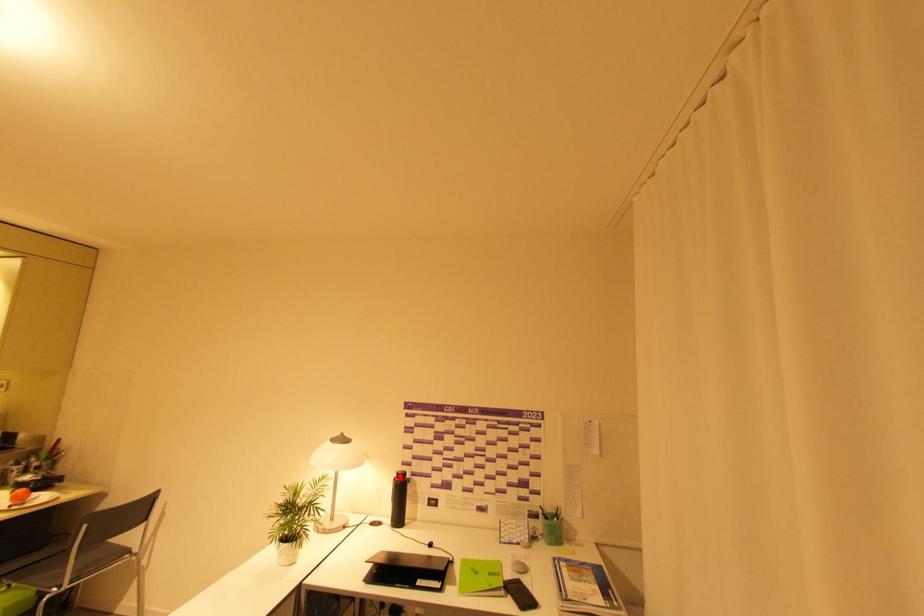
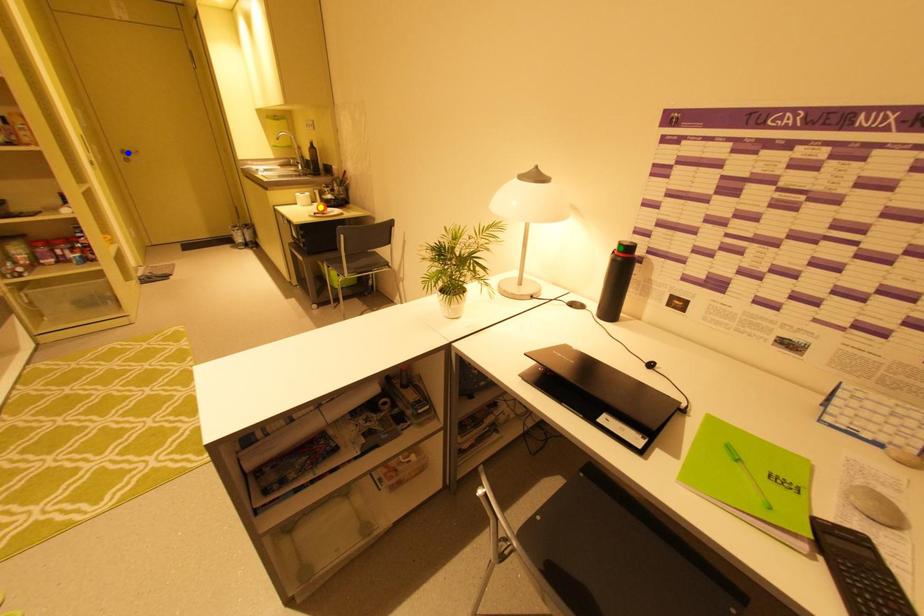
Question: I am providing you with two images of the same scene from different viewpoints. A red point is marked on the first image. You are given multiple points on the second image. Can you choose the point in image 2 that corresponds to the point in image 1?

Choices:
 (A) yellow point
 (B) blue point
 (C) green point

Answer: (C)